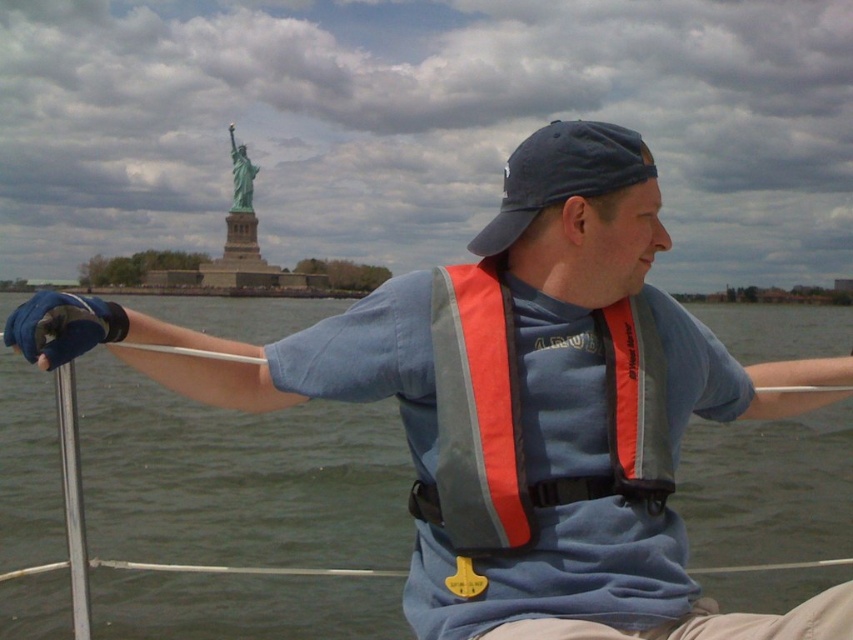
Based on the photo, you are a photographer trying to capture a photo of the blue fabric baseball cap at center and the green patina statue at upper center in the background. Based on their sizes in the image, which object would appear smaller in the final photo?

The blue fabric baseball cap at center appears smaller in the photo because it is shorter than the green patina statue at upper center.

Consider the image. You are a photographer trying to capture the green patina statue at upper center and the blue fabric baseball cap at center in a single shot. Based on their positions, which object should you focus on first to ensure both are in frame?

The blue fabric baseball cap at center is located below the green patina statue at upper center, so you should focus on the green patina statue at upper center first to ensure both are in frame.

You are a photographer trying to capture a photo of the green patina statue at upper center and the blue fabric baseball cap at center. From the perspective of someone standing on the boat, which object would appear closer to the right side of the photo?

The blue fabric baseball cap at center is positioned to the right of the green patina statue at upper center, so it would appear closer to the right side of the photo.